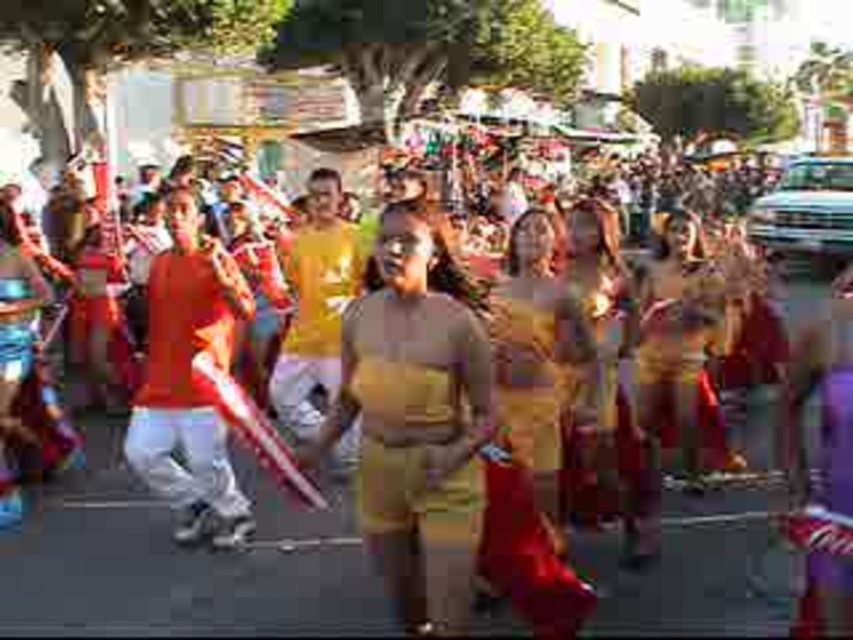
Who is positioned more to the left, matte gold skirt at center or matte yellow dress at center?

From the viewer's perspective, matte yellow dress at center appears more on the left side.

Does point (682, 428) come farther from viewer compared to point (537, 285)?

Yes.

Image resolution: width=853 pixels, height=640 pixels. Describe the element at coordinates (679, 346) in the screenshot. I see `matte gold skirt at center` at that location.

This screenshot has width=853, height=640. Identify the location of matte gold skirt at center. (679, 346).

Does matte gold shorts at center appear on the right side of matte gold skirt at center?

No, matte gold shorts at center is not to the right of matte gold skirt at center.

Is point (416, 371) in front of point (698, 417)?

Yes.

You are a GUI agent. You are given a task and a screenshot of the screen. Output one action in this format:
    pyautogui.click(x=<x>, y=<y>)
    Task: Click on the matte gold shorts at center
    This screenshot has height=640, width=853.
    Given the screenshot: What is the action you would take?
    pyautogui.click(x=405, y=404)

Measure the distance between point (517, 444) and camera.

11.29 meters

Is matte yellow dress at center thinner than matte red dress at left?

Yes, matte yellow dress at center is thinner than matte red dress at left.

I want to click on matte yellow dress at center, so click(527, 369).

What are the coordinates of `matte yellow dress at center` in the screenshot? It's located at (527, 369).